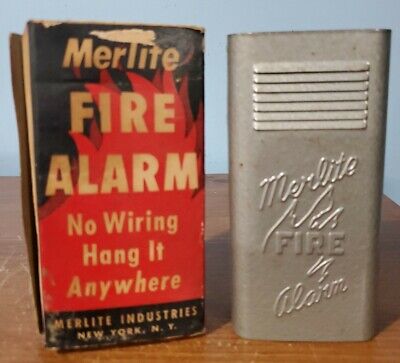
Identify the location of fire alarm. (337, 208).